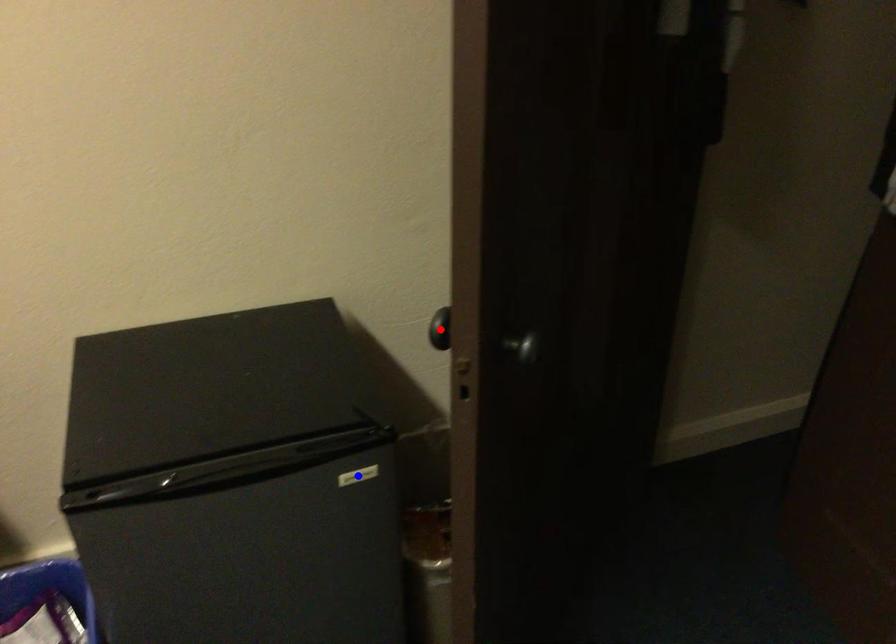
Question: Which of the two points in the image is closer to the camera?

Choices:
 (A) Blue point is closer.
 (B) Red point is closer.

Answer: (B)